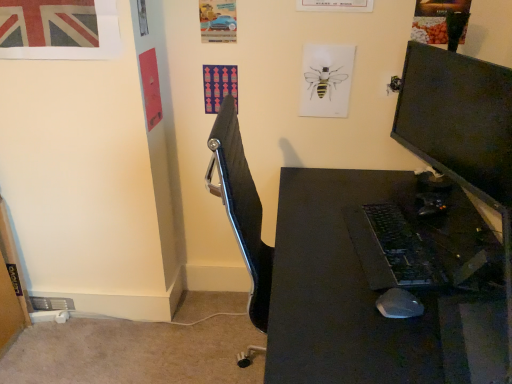
Question: From the image's perspective, is black plastic keyboard at center-right positioned above or below union jack paper at upper left, marked as the second poster page in a right-to-left arrangement?

Choices:
 (A) above
 (B) below

Answer: (B)

Question: Considering the positions of black plastic keyboard at center-right and union jack paper at upper left, arranged as the second poster page when viewed from the back, in the image, is black plastic keyboard at center-right wider or thinner than union jack paper at upper left, arranged as the second poster page when viewed from the back,?

Choices:
 (A) thin
 (B) wide

Answer: (B)

Question: Estimate the real-world distances between objects in this image. Which object is closer to the black plastic desk at center?

Choices:
 (A) metallic blue car at upper center, the 1th poster page positioned from the right
 (B) black plastic mouse at lower right
 (C) black glossy monitor at right
 (D) black plastic keyboard at center-right
 (E) union jack paper at upper left, arranged as the second poster page when viewed from the back

Answer: (D)

Question: Based on their relative distances, which object is nearer to the union jack paper at upper left, arranged as the second poster page when viewed from the back?

Choices:
 (A) metallic blue car at upper center, the first poster page from the back
 (B) black plastic mouse at lower right
 (C) black glossy monitor at right
 (D) black plastic desk at center
 (E) black plastic keyboard at center-right

Answer: (A)